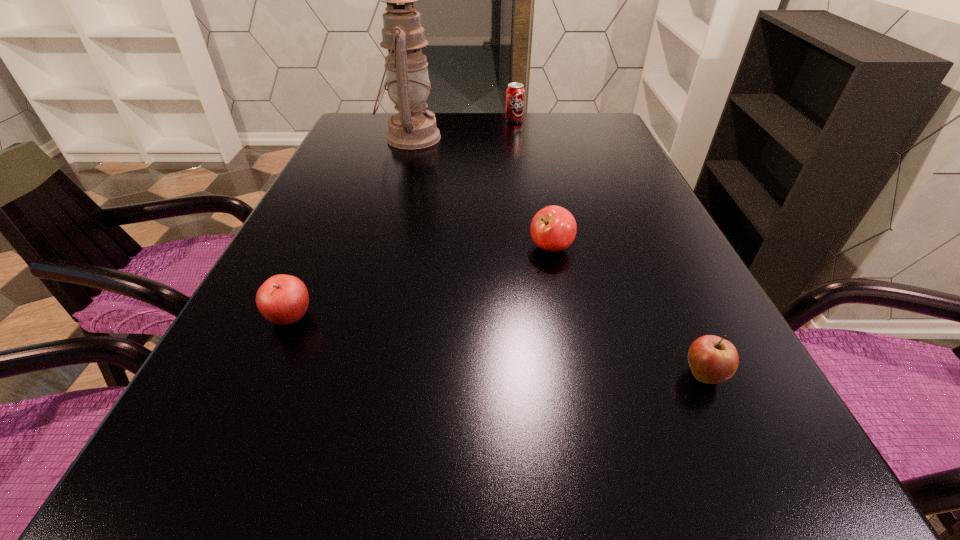
Locate an element on the screen. vacant space located 0.310m on the back of the farthest apple is located at coordinates (535, 166).

Where is `free space located 0.050m on the back of the second nearest apple`? free space located 0.050m on the back of the second nearest apple is located at coordinates (306, 281).

Where is `free location located on the left of the nearest object`? The image size is (960, 540). free location located on the left of the nearest object is located at coordinates (582, 375).

At what (x,y) coordinates should I click in order to perform the action: click on oil lamp that is positioned at the far edge. Please return your answer as a coordinate pair (x, y). Looking at the image, I should click on pos(407,80).

The image size is (960, 540). What are the coordinates of `soda located at the far edge` in the screenshot? It's located at (515, 93).

Locate an element on the screen. oil lamp present at the left edge is located at coordinates point(407,80).

Where is `apple that is at the left edge`? This screenshot has width=960, height=540. apple that is at the left edge is located at coordinates (283, 299).

Find the location of `object that is at the right edge`. object that is at the right edge is located at coordinates (712, 359).

You are a GUI agent. You are given a task and a screenshot of the screen. Output one action in this format:
    pyautogui.click(x=<x>, y=<y>)
    Task: Click on the object at the far left corner
    This screenshot has width=960, height=540.
    Given the screenshot: What is the action you would take?
    pyautogui.click(x=407, y=80)

In order to click on blank space at the far edge of the desktop in this screenshot , I will do `click(453, 126)`.